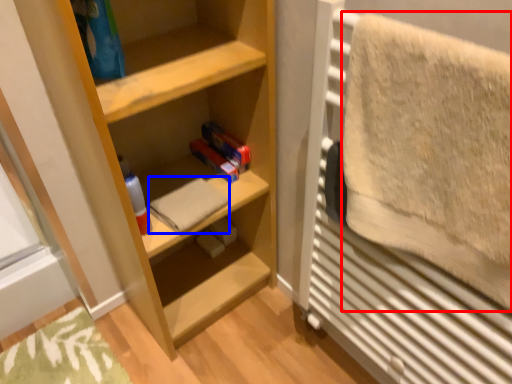
Question: Which of the following is the farthest to the observer, bath towel (highlighted by a red box) or bath towel (highlighted by a blue box)?

Choices:
 (A) bath towel
 (B) bath towel

Answer: (B)